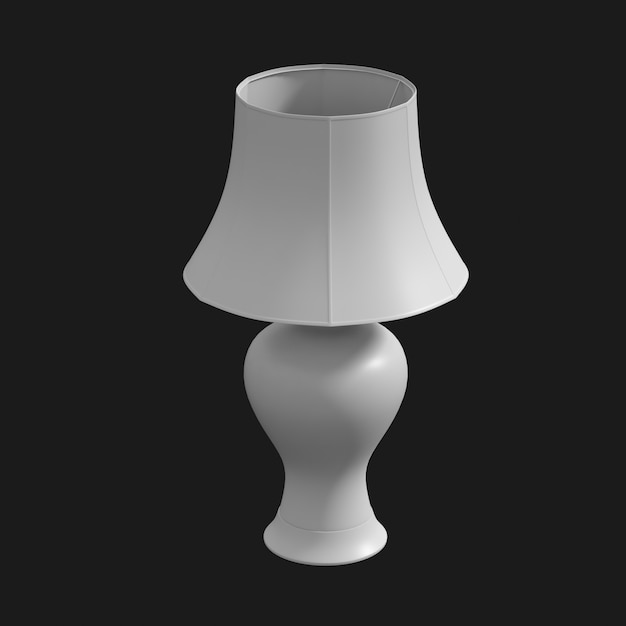
This screenshot has width=626, height=626. In order to click on 3d lamp in this screenshot , I will do `click(393, 349)`.